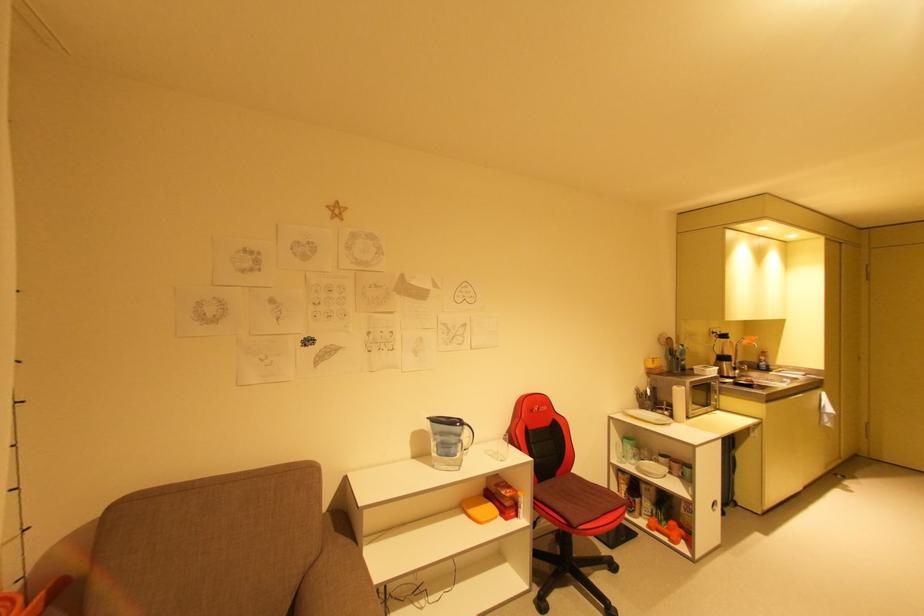
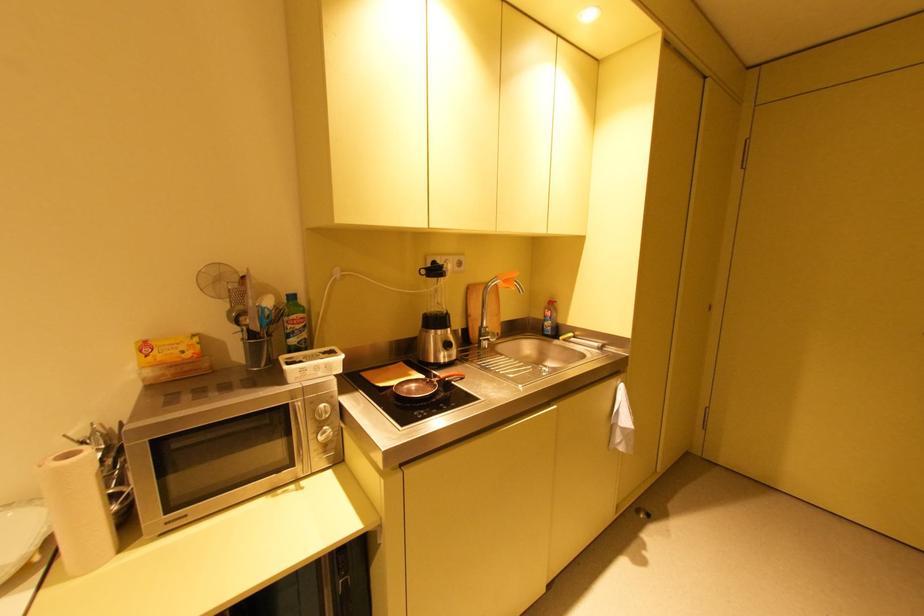
Where in the second image is the point corresponding to the point at 734,363 from the first image?

(444, 331)